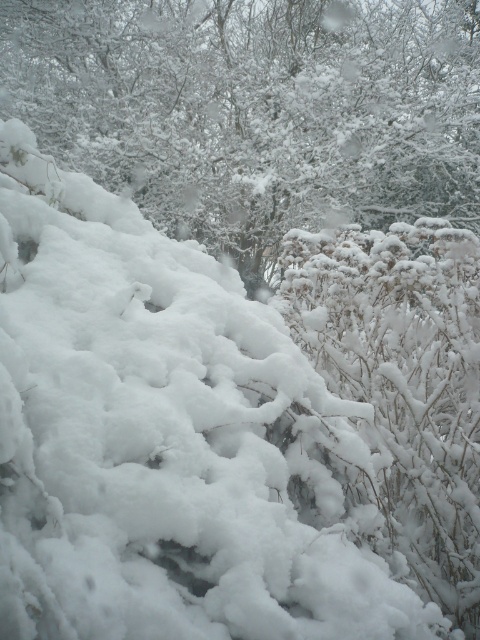
You are a photographer trying to capture the white fluffy snow at center and the white fluffy bush at center in a single frame. Which object should you focus on first if you want the one closer to you to be sharp?

The white fluffy snow at center is positioned on the right side of white fluffy bush at center, so you should focus on the white fluffy bush at center first as it is closer to you.

You are a photographer wanting to capture both the white fluffy snow at center and the white fluffy bush at center in a single frame. Given that your camera has a maximum focus range of 10 meters, will you be able to focus on both objects simultaneously?

The white fluffy snow at center is 12.71 meters from the white fluffy bush at center. Since the distance between them exceeds the camera lens focus range of 10 meters, the camera cannot focus on both objects at the same time.